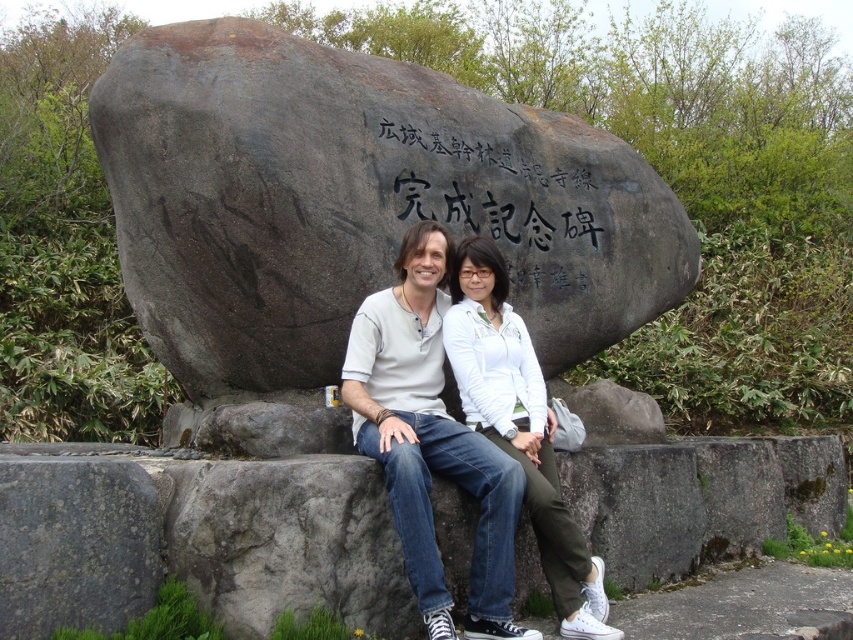
You are a photographer setting up a shot of the dark gray stone boulder at center and the black stone engraving at center. Which object should you focus on first if you want to capture the larger subject in your frame?

The dark gray stone boulder at center is bigger than the black stone engraving at center, so you should focus on the dark gray stone boulder at center first to capture the larger subject.

You are standing in front of the large dark gray boulder with Japanese characters. There is a gray rough stone at lower left marked by point (74, 544). If you want to place a small commemorative plaque on the gray rough stone at lower left, where exactly should you place it?

The gray rough stone at lower left is located at point (74, 544), so you should place the small commemorative plaque at that coordinate.

You are a photographer trying to capture both the dark gray stone boulder at center and the black stone engraving at center in a single frame. Based on their positions, which object should you focus on first to ensure both are in the shot?

The dark gray stone boulder at center is positioned on the left side of the black stone engraving at center. To capture both in a single frame, focus on the dark gray stone boulder at center first since it is closer to the left edge, allowing the engraving to naturally fall into the frame on the right.